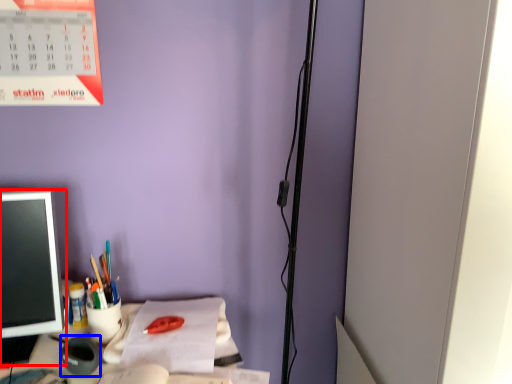
Question: Which of the following is the farthest to the observer, office supplies (highlighted by a red box) or stationery (highlighted by a blue box)?

Choices:
 (A) office supplies
 (B) stationery

Answer: (B)